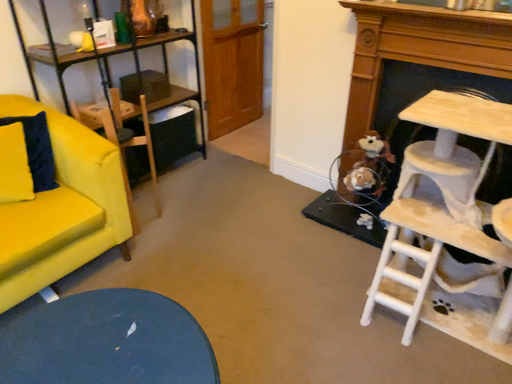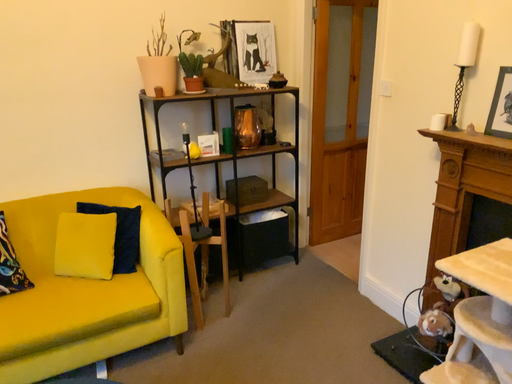
Question: How did the camera likely rotate when shooting the video?

Choices:
 (A) rotated upward
 (B) rotated downward

Answer: (A)